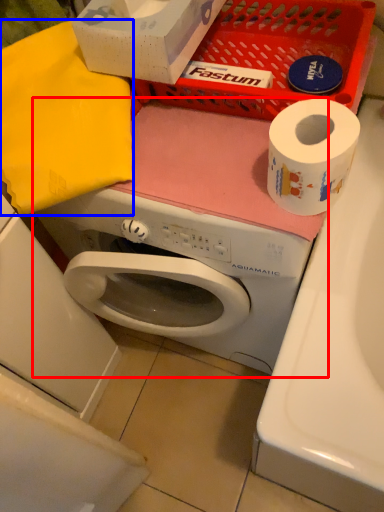
Question: Which of the following is the closest to the observer, washing machine (highlighted by a red box) or clothe (highlighted by a blue box)?

Choices:
 (A) washing machine
 (B) clothe

Answer: (A)